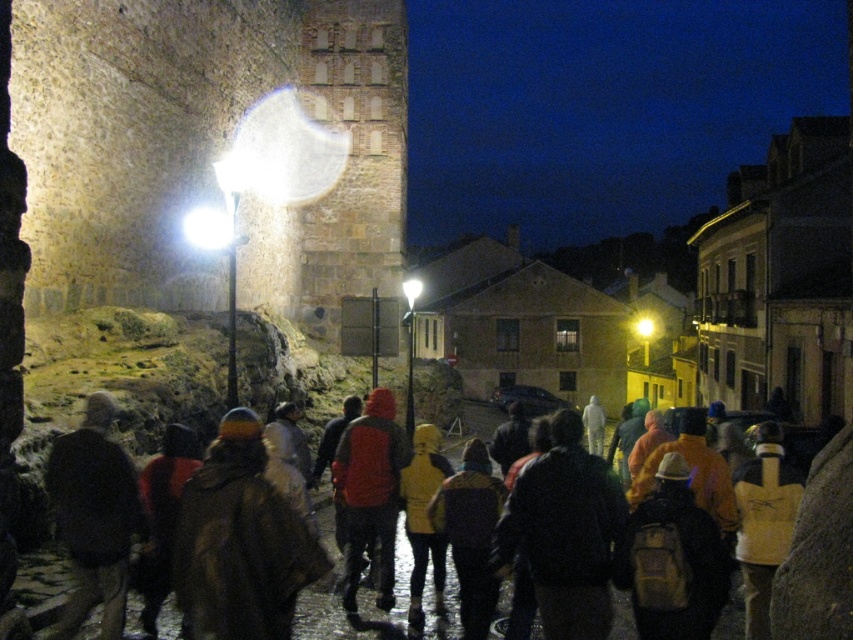
Consider the image. You are standing on the cobblestone street in the historic area and notice two people wearing coats. The first person has a brown fuzzy coat at lower left and the second has a brown textured jacket at center. Which of these two coats is taller?

The brown fuzzy coat at lower left is taller than the brown textured jacket at center.

You are a photographer trying to capture the brick textured tower at center in your shot. However, there is a brown textured jacket at center blocking your view. Can you adjust your position so that the tower is visible without the jacket obstructing it?

The brown textured jacket at center is behind the brick textured tower at center, so adjusting your position might not be necessary. The tower is already in front of the jacket, so the jacket is behind the tower and shouldn

You are standing at the camera position and see two points in the scene. The first point is at coordinate point(403,54) and the second point is at point(86,634). Which point is closer to you?

Point(86,634) is closer to you because it is in front of point(403,54).